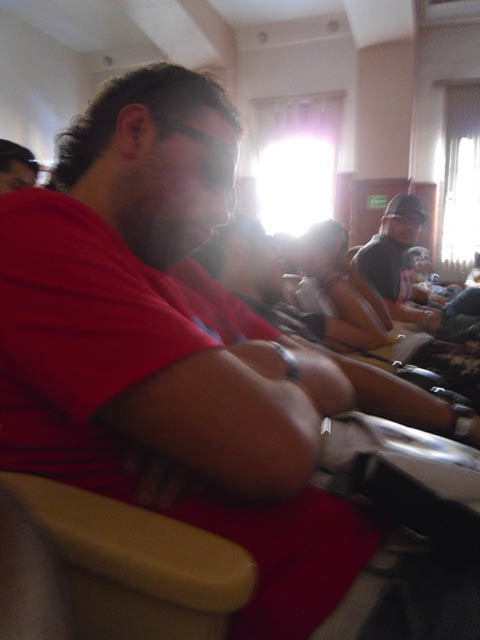
Consider the image. Can you confirm if dark gray cap at upper right is positioned below matte red shirt at center?

Indeed, dark gray cap at upper right is positioned under matte red shirt at center.

Which of these two, dark gray cap at upper right or matte red shirt at center, stands shorter?

matte red shirt at center is shorter.

Who is more distant from viewer, (406, 316) or (24, 156)?

The point (406, 316) is more distant.

Identify the location of dark gray cap at upper right. (397, 262).

Measure the distance between point [172,637] and camera.

Point [172,637] and camera are 20.76 inches apart from each other.

Can you confirm if smooth beige armrest at lower left is taller than matte red shirt at center?

Incorrect, smooth beige armrest at lower left's height is not larger of matte red shirt at center's.

The width and height of the screenshot is (480, 640). Find the location of `smooth beige armrest at lower left`. smooth beige armrest at lower left is located at coordinates (136, 564).

Between smooth beige armrest at lower left and dark gray cap at upper right, which one is positioned lower?

smooth beige armrest at lower left

Does point (142, 522) come behind point (408, 244)?

That is False.

Is point (96, 516) positioned before point (385, 216)?

Yes.

Locate an element on the screen. smooth beige armrest at lower left is located at coordinates (136, 564).